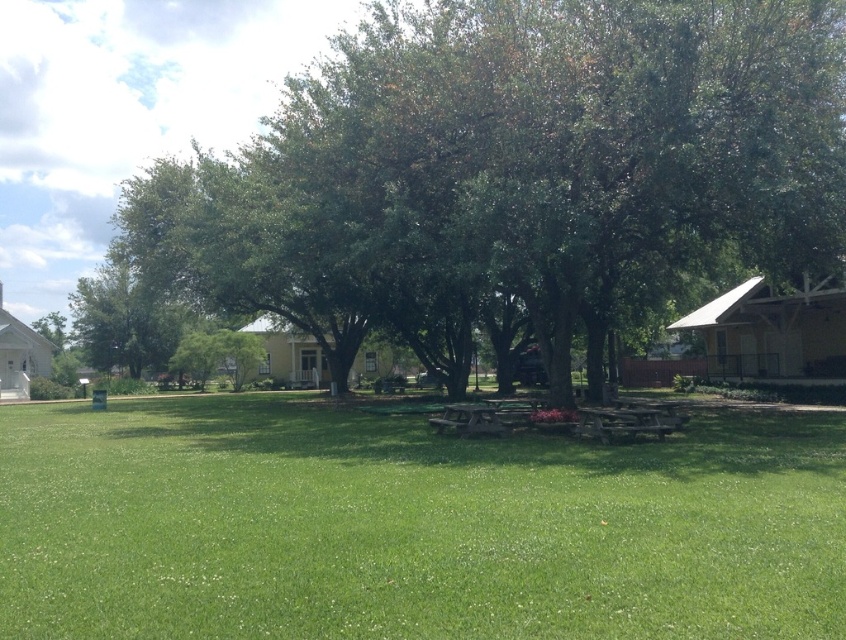
You are planning to set up a small tent in the park. The tent requires a flat area that is larger than the green grass at center. Can you use the space under the green leafy tree at center for this purpose?

The green leafy tree at center has a larger size compared to green grass at center. Therefore, the space under the green leafy tree at center is large enough to accommodate the tent requiring a flat area larger than the green grass at center.

You are standing at the center of the park and want to find the green leafy tree at center. What are the coordinates of the tree?

The coordinates of the green leafy tree at center are at point (x=511, y=170).